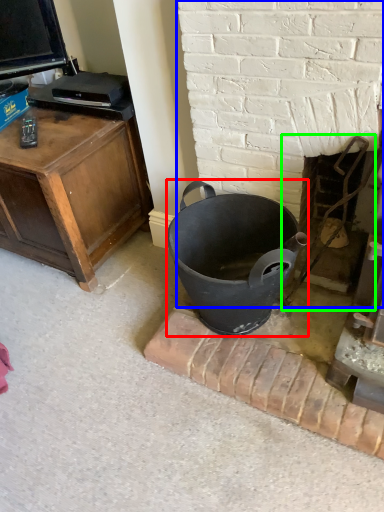
Question: Estimate the real-world distances between objects in this image. Which object is farther from trash bin/can (highlighted by a red box), fireplace (highlighted by a blue box) or fireplace (highlighted by a green box)?

Choices:
 (A) fireplace
 (B) fireplace

Answer: (B)